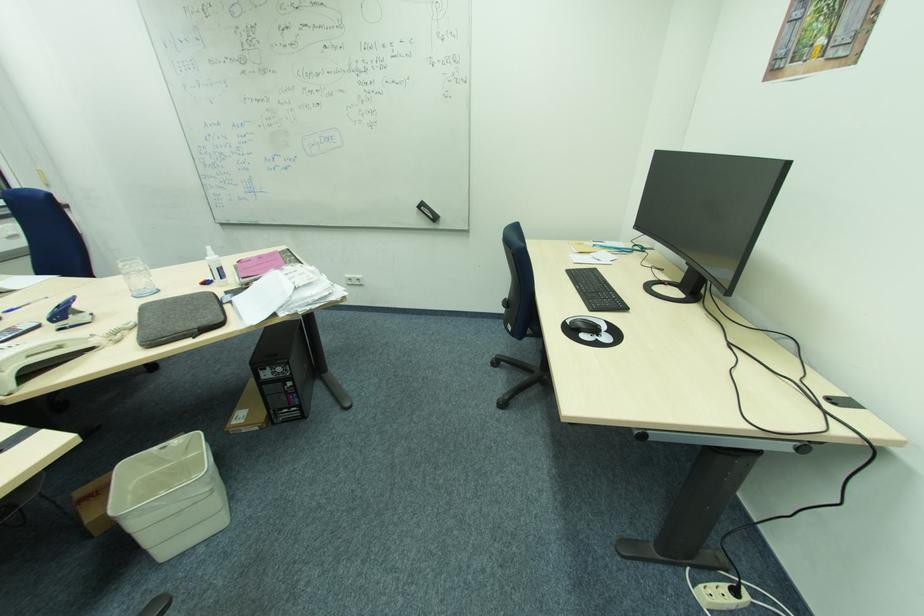
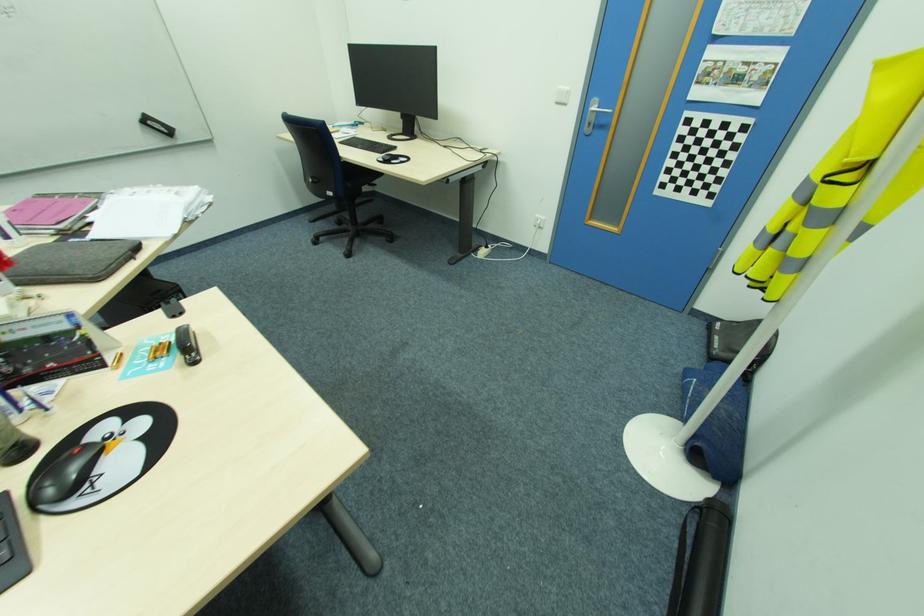
Locate, in the second image, the point that corresponds to point 426,208 in the first image.

(151, 123)